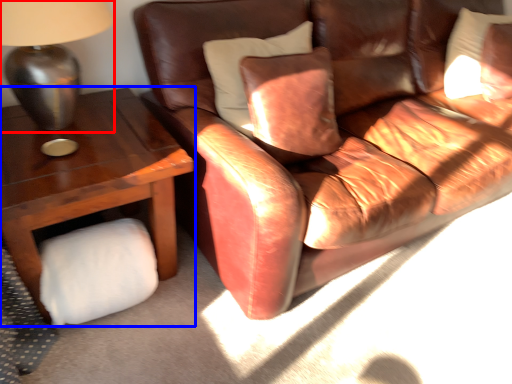
Question: Which object appears farthest to the camera in this image, table lamp (highlighted by a red box) or table (highlighted by a blue box)?

Choices:
 (A) table lamp
 (B) table

Answer: (B)